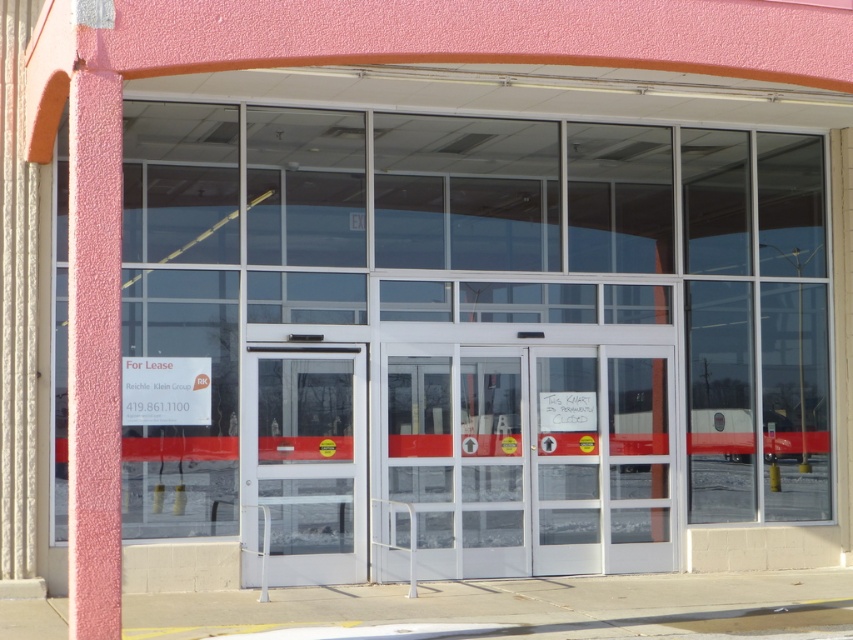
Question: Can you confirm if pink textured pillar at left is positioned below transparent glass door at center?

Choices:
 (A) no
 (B) yes

Answer: (A)

Question: Does pink textured pillar at left have a smaller size compared to transparent glass door at center?

Choices:
 (A) no
 (B) yes

Answer: (B)

Question: Observing the image, what is the correct spatial positioning of pink textured pillar at left in reference to transparent glass door at center?

Choices:
 (A) left
 (B) right

Answer: (A)

Question: Which point is closer to the camera taking this photo?

Choices:
 (A) (103, 104)
 (B) (312, 404)

Answer: (A)

Question: Which of the following is the farthest from the observer?

Choices:
 (A) transparent glass door at center
 (B) pink textured pillar at left

Answer: (A)